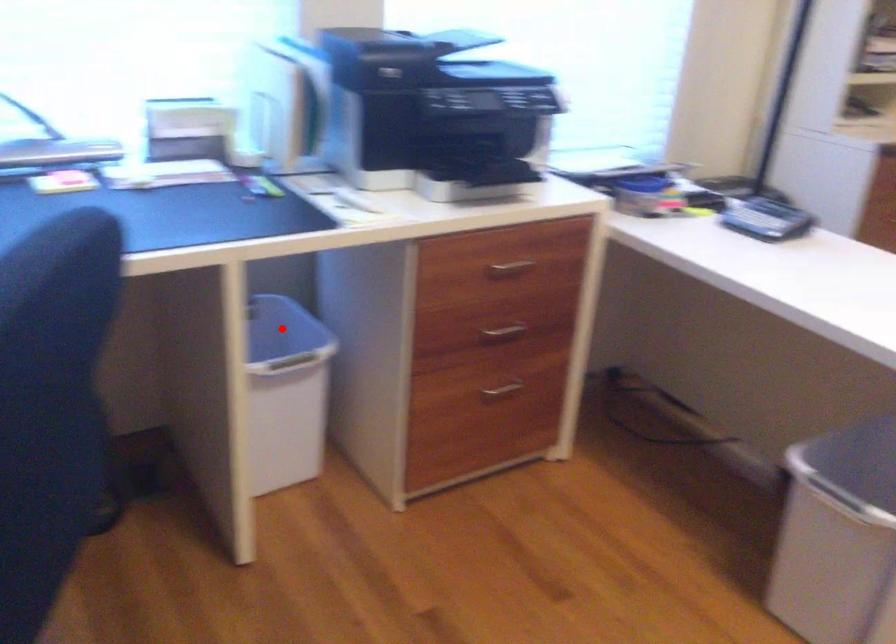
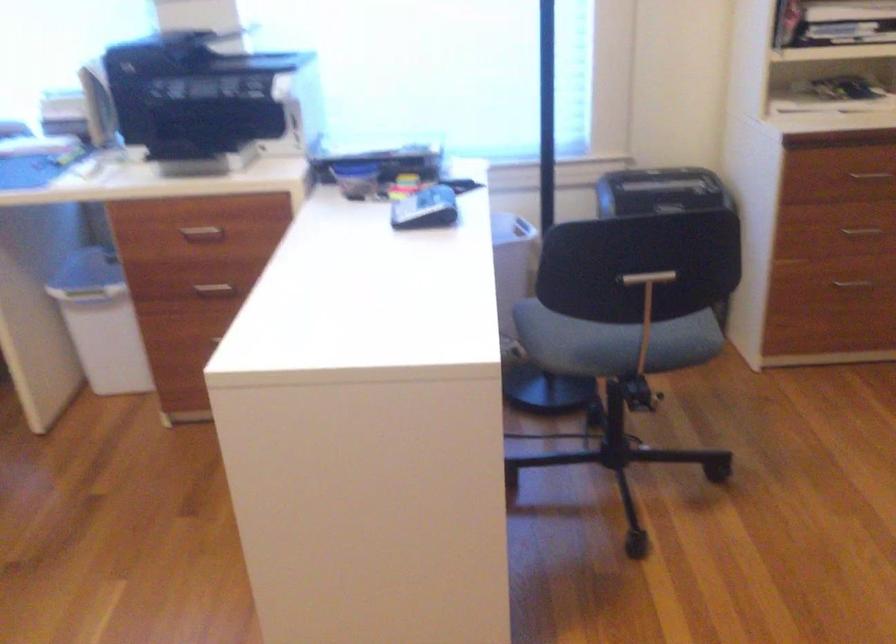
Question: I am providing you with two images of the same scene from different viewpoints. A red point is marked on the first image. At the location where the point appears in image 1, is it still visible in image 2?

Choices:
 (A) Yes
 (B) No

Answer: (B)